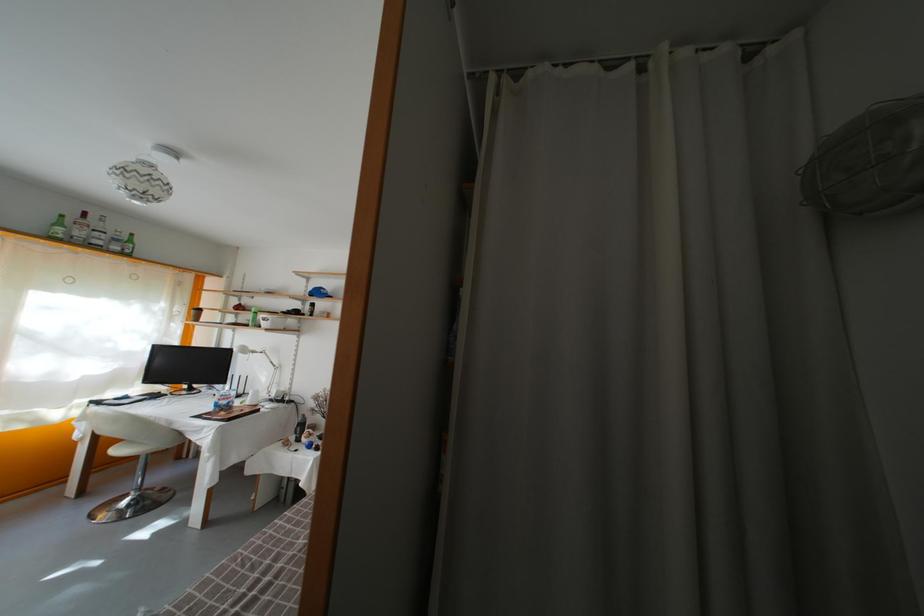
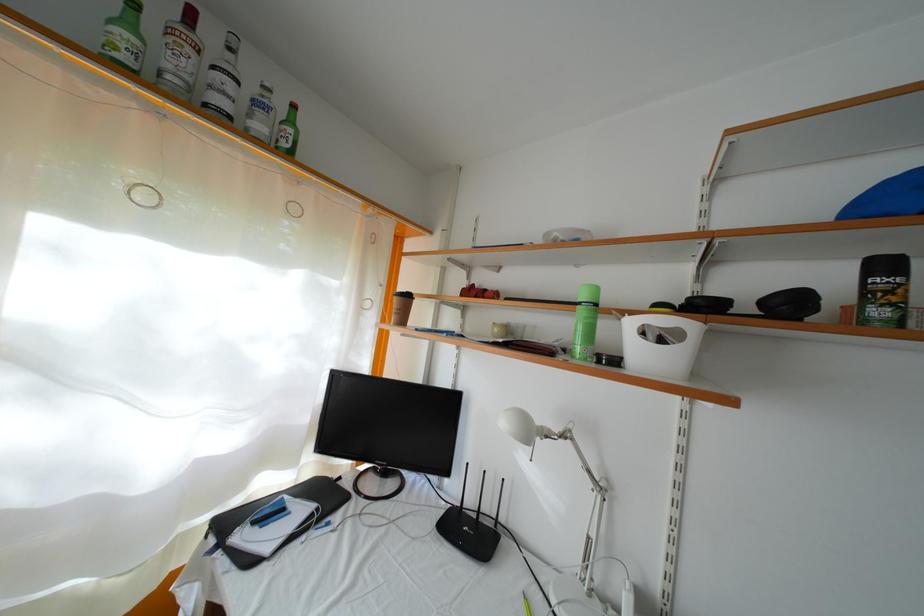
Locate, in the second image, the point that corresponds to the point at 161,403 in the first image.

(334, 506)